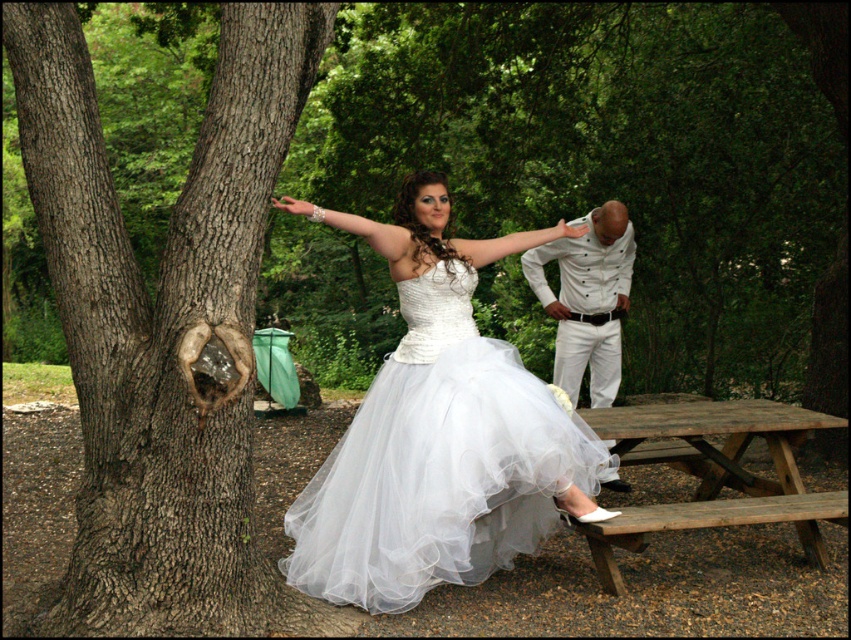
Is brown rough bark tree at left in front of wooden picnic table at lower right?

That is True.

Consider the image. Who is more distant from viewer, [124,244] or [797,442]?

The point [797,442] is behind.

Describe the element at coordinates (163, 323) in the screenshot. I see `brown rough bark tree at left` at that location.

This screenshot has height=640, width=851. I want to click on brown rough bark tree at left, so coord(163,323).

Between point (118, 516) and point (592, 406), which one is positioned behind?

Positioned behind is point (592, 406).

Can you confirm if brown rough bark tree at left is smaller than white textured shirt at center?

No.

Who is more distant from viewer, (93,488) or (614,244)?

The point (614,244) is more distant.

Identify the location of brown rough bark tree at left. (163, 323).

Who is more forward, [210,380] or [328,596]?

Point [210,380]

Who is positioned more to the right, brown rough bark tree at left or white tulle dress at center?

Positioned to the right is white tulle dress at center.

Who is more forward, (236, 477) or (430, 356)?

Point (236, 477) is in front.

The image size is (851, 640). Find the location of `brown rough bark tree at left`. brown rough bark tree at left is located at coordinates (163, 323).